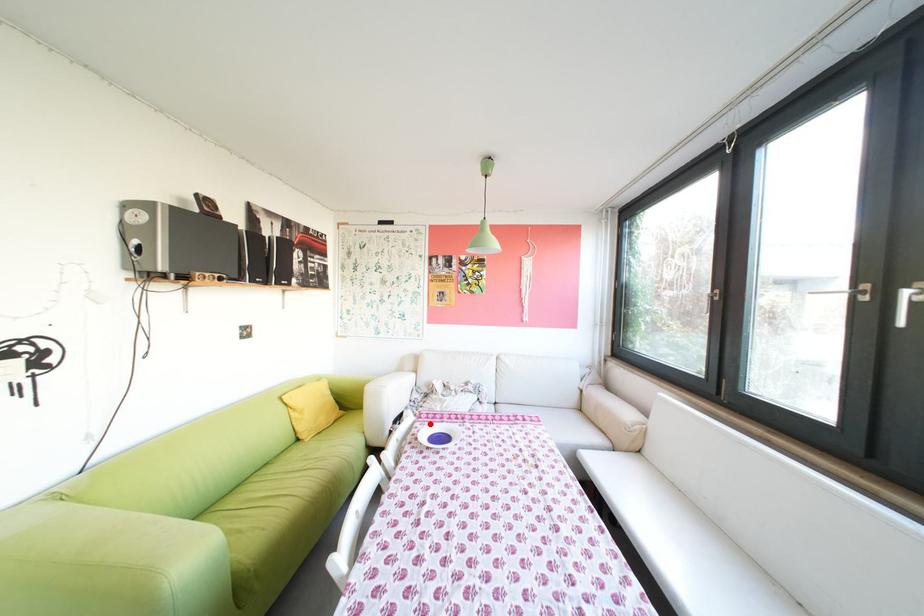
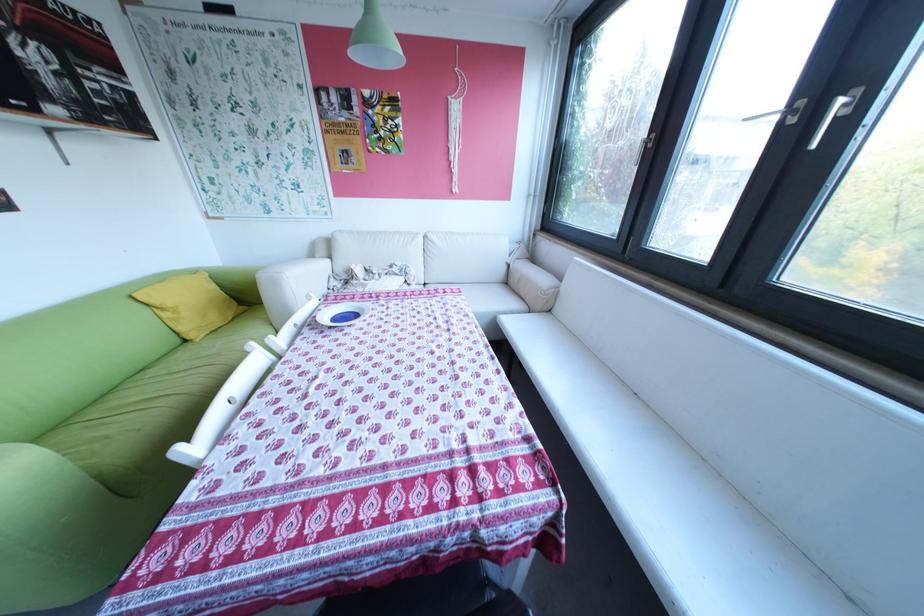
Question: A red point is marked in image1. In image2, is the corresponding 3D point closer to the camera or farther? Reply with the corresponding letter.

Choices:
 (A) The corresponding 3D point is closer.
 (B) The corresponding 3D point is farther.

Answer: (B)